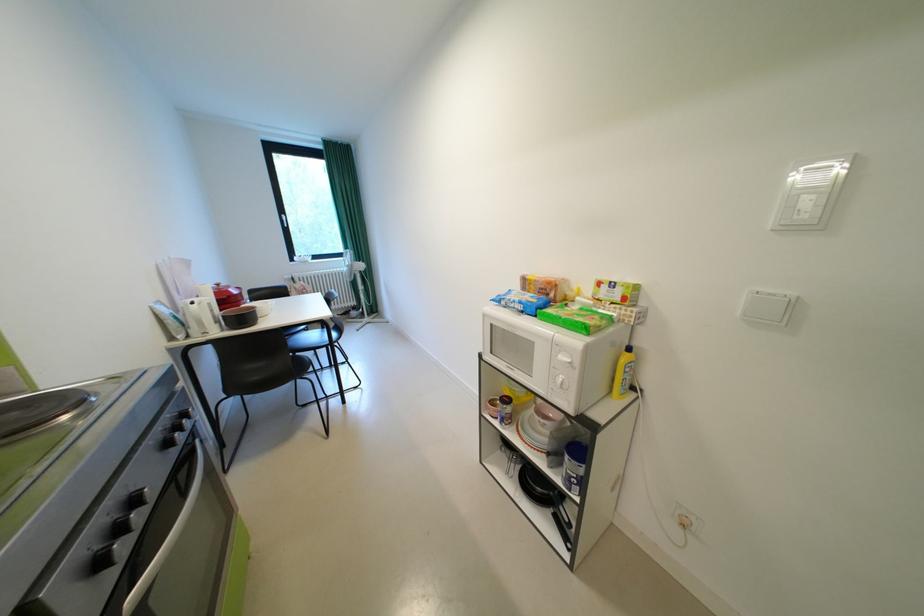
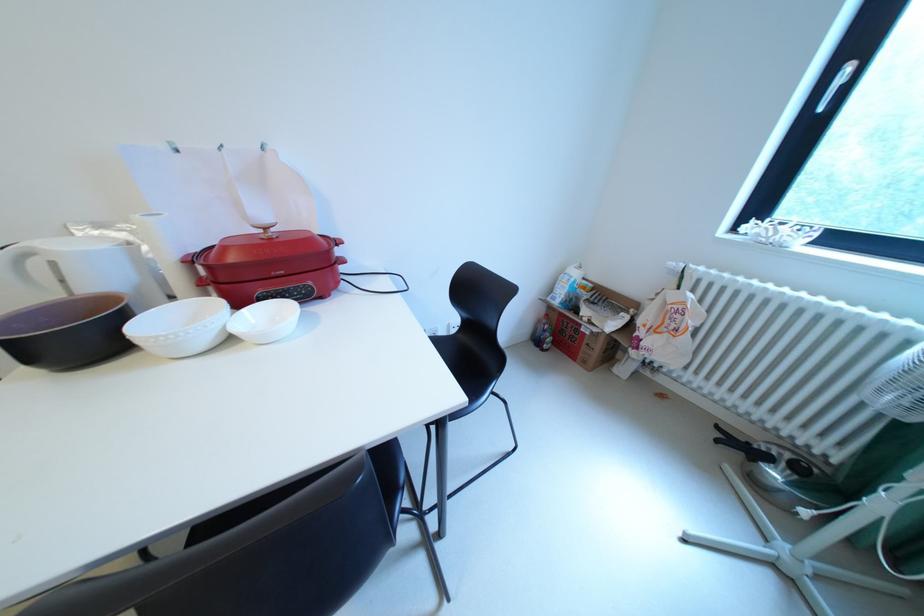
Find the pixel in the second image that matches point (308, 286) in the first image.

(682, 297)